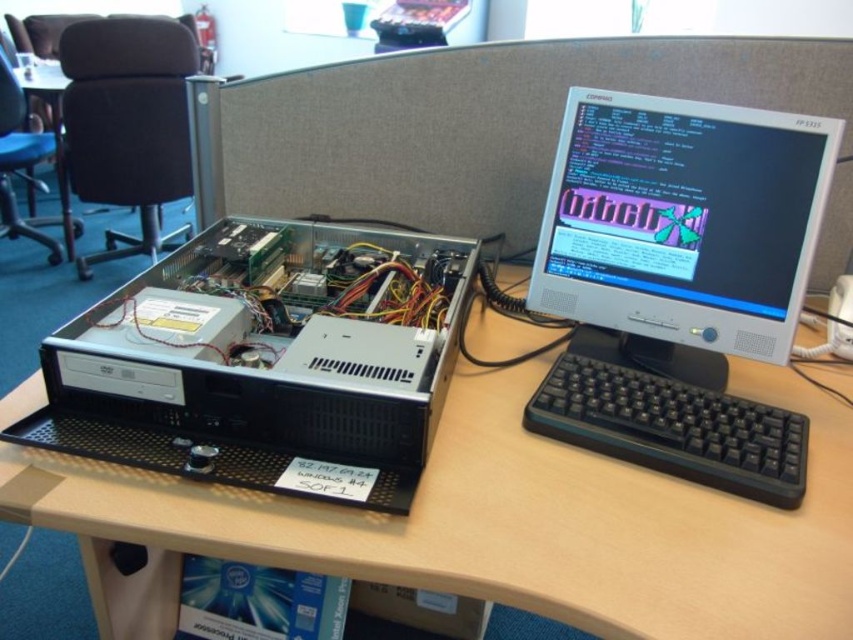
Which is below, matte silver monitor at upper right or black plastic keyboard at lower right?

black plastic keyboard at lower right is lower down.

Identify the location of matte silver monitor at upper right. tap(682, 228).

Find the location of `matte silver monitor at upper right`. matte silver monitor at upper right is located at coordinates (682, 228).

Which is behind, point (788, 563) or point (473, 241)?

The point (473, 241) is behind.

Between black plastic computer desk at center and silver metallic computer case at left, which one appears on the right side from the viewer's perspective?

black plastic computer desk at center

Image resolution: width=853 pixels, height=640 pixels. I want to click on black plastic computer desk at center, so click(519, 522).

From the picture: Is black plastic keyboard at lower right thinner than wooden desk at lower left?

Yes, black plastic keyboard at lower right is thinner than wooden desk at lower left.

Can you confirm if black plastic keyboard at lower right is smaller than wooden desk at lower left?

Yes.

I want to click on black plastic keyboard at lower right, so click(x=672, y=428).

The height and width of the screenshot is (640, 853). What are the coordinates of `black plastic keyboard at lower right` in the screenshot? It's located at (672, 428).